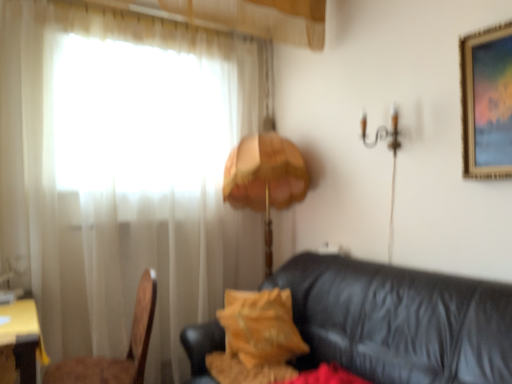
Question: Is velvet yellow pillow at center positioned in front of black leather couch at lower right?

Choices:
 (A) yes
 (B) no

Answer: (B)

Question: Is velvet yellow pillow at center at the right side of black leather couch at lower right?

Choices:
 (A) yes
 (B) no

Answer: (B)

Question: Are velvet yellow pillow at center and black leather couch at lower right making contact?

Choices:
 (A) no
 (B) yes

Answer: (A)

Question: Is velvet yellow pillow at center surrounding black leather couch at lower right?

Choices:
 (A) no
 (B) yes

Answer: (A)

Question: Can we say velvet yellow pillow at center lies outside black leather couch at lower right?

Choices:
 (A) no
 (B) yes

Answer: (A)

Question: Can you confirm if velvet yellow pillow at center is bigger than black leather couch at lower right?

Choices:
 (A) no
 (B) yes

Answer: (A)

Question: Could you tell me if orange fabric lampshade at center is turned towards white sheer curtain at left?

Choices:
 (A) yes
 (B) no

Answer: (A)

Question: Is orange fabric lampshade at center wider than white sheer curtain at left?

Choices:
 (A) no
 (B) yes

Answer: (B)

Question: From a real-world perspective, is orange fabric lampshade at center physically below white sheer curtain at left?

Choices:
 (A) no
 (B) yes

Answer: (B)

Question: Is the surface of orange fabric lampshade at center in direct contact with white sheer curtain at left?

Choices:
 (A) yes
 (B) no

Answer: (B)

Question: Can you confirm if orange fabric lampshade at center is positioned to the right of white sheer curtain at left?

Choices:
 (A) yes
 (B) no

Answer: (A)

Question: From the image's perspective, is orange fabric lampshade at center on top of white sheer curtain at left?

Choices:
 (A) no
 (B) yes

Answer: (A)

Question: Is yellow wood table at lower left positioned before white sheer curtain at left?

Choices:
 (A) yes
 (B) no

Answer: (A)